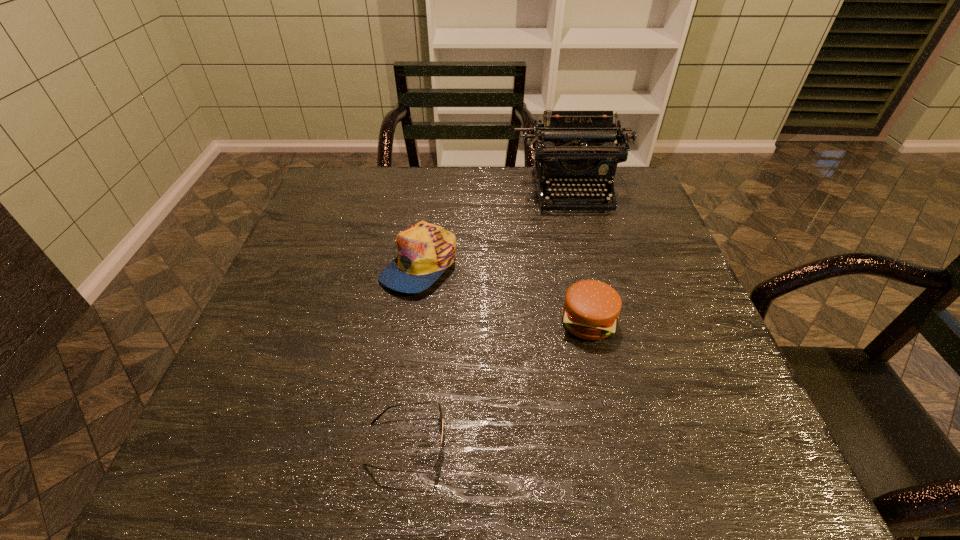
This screenshot has width=960, height=540. I want to click on free spot between the third shortest object and the farthest object, so click(495, 227).

At what (x,y) coordinates should I click in order to perform the action: click on object that is the closest to the cap. Please return your answer as a coordinate pair (x, y). Looking at the image, I should click on (570, 147).

Locate which object is the closest to the third farthest object. Please provide its 2D coordinates. Your answer should be formatted as a tuple, i.e. [(x, y)], where the tuple contains the x and y coordinates of a point satisfying the conditions above.

[(426, 250)]

Identify the location of vacant position in the image that satisfies the following two spatial constraints: 1. on the keyboard of the typewriter; 2. on the front-facing side of the sunglasses. (639, 444).

Locate an element on the screen. This screenshot has height=540, width=960. vacant position in the image that satisfies the following two spatial constraints: 1. on the front side of the third tallest object; 2. on the front-facing side of the shortest object is located at coordinates (615, 444).

Where is `free space that satisfies the following two spatial constraints: 1. on the keyboard of the farthest object; 2. on the front-facing side of the sunglasses`? free space that satisfies the following two spatial constraints: 1. on the keyboard of the farthest object; 2. on the front-facing side of the sunglasses is located at coordinates (639, 444).